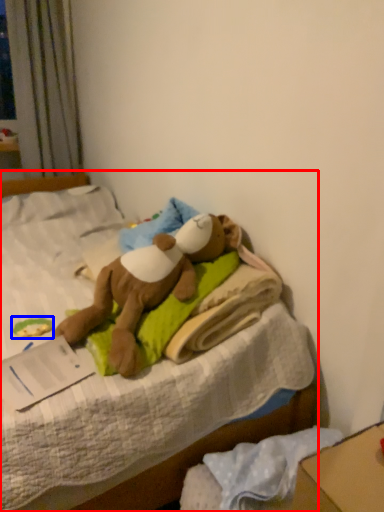
Question: Which object appears closest to the camera in this image, bed (highlighted by a red box) or toy (highlighted by a blue box)?

Choices:
 (A) bed
 (B) toy

Answer: (A)